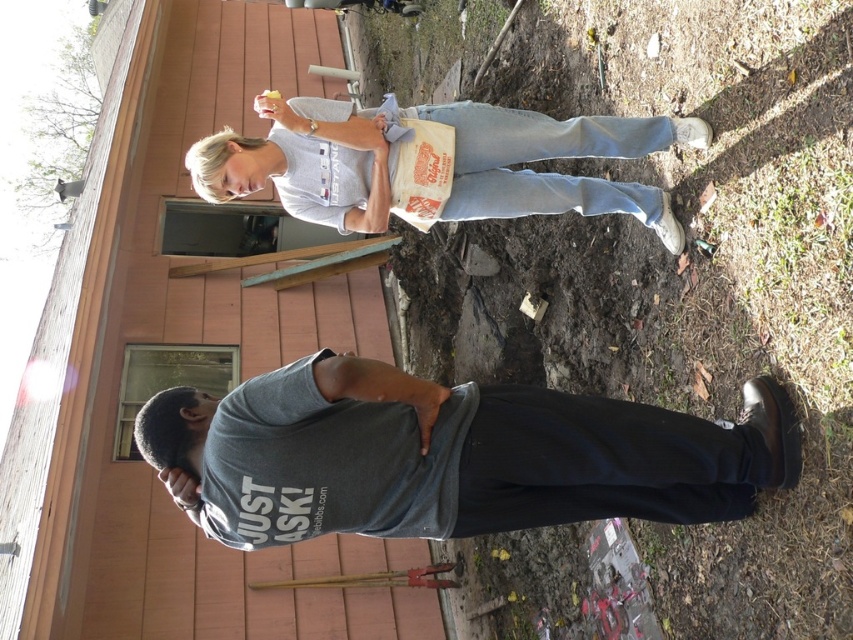
Question: Is white paper bag at upper center smaller than green leafy tree at upper left?

Choices:
 (A) no
 (B) yes

Answer: (B)

Question: Does white paper bag at upper center have a smaller size compared to green leafy tree at upper left?

Choices:
 (A) no
 (B) yes

Answer: (B)

Question: Estimate the real-world distances between objects in this image. Which object is closer to the green leafy tree at upper left?

Choices:
 (A) dark gray t-shirt at center
 (B) white paper bag at upper center

Answer: (B)

Question: Is dark gray t-shirt at center above white paper bag at upper center?

Choices:
 (A) no
 (B) yes

Answer: (A)

Question: Which of these objects is positioned closest to the white paper bag at upper center?

Choices:
 (A) dark gray t-shirt at center
 (B) green leafy tree at upper left

Answer: (A)

Question: Which point is closer to the camera taking this photo?

Choices:
 (A) (550, 449)
 (B) (283, 129)
 (C) (35, 212)

Answer: (A)